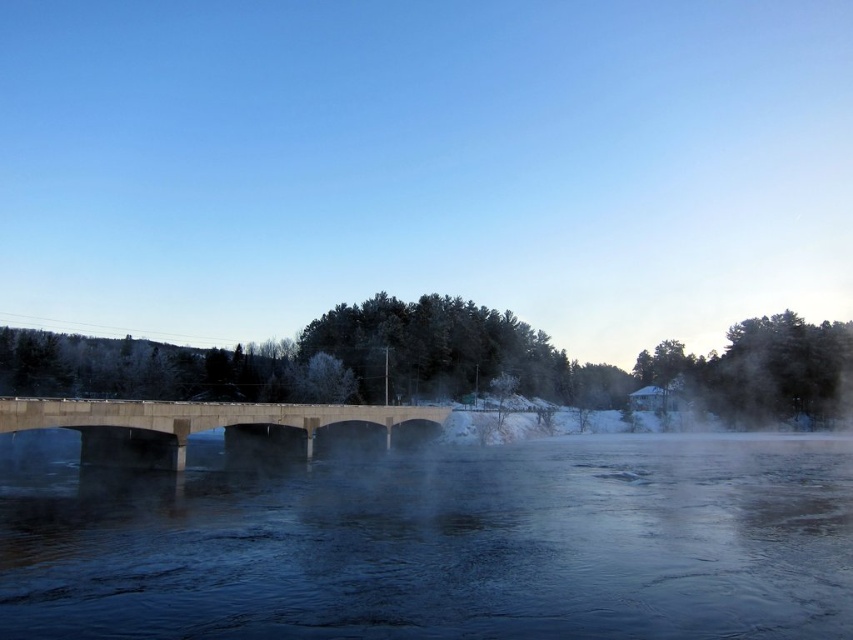
Question: Which object is closer to the camera taking this photo?

Choices:
 (A) concrete bridge at center
 (B) dark blue water at center

Answer: (B)

Question: Does dark blue water at center appear over concrete bridge at center?

Choices:
 (A) no
 (B) yes

Answer: (A)

Question: Is dark blue water at center to the right of concrete bridge at center from the viewer's perspective?

Choices:
 (A) no
 (B) yes

Answer: (B)

Question: Which point is farther to the camera?

Choices:
 (A) (187, 408)
 (B) (26, 492)

Answer: (A)

Question: Does dark blue water at center appear on the left side of concrete bridge at center?

Choices:
 (A) no
 (B) yes

Answer: (A)